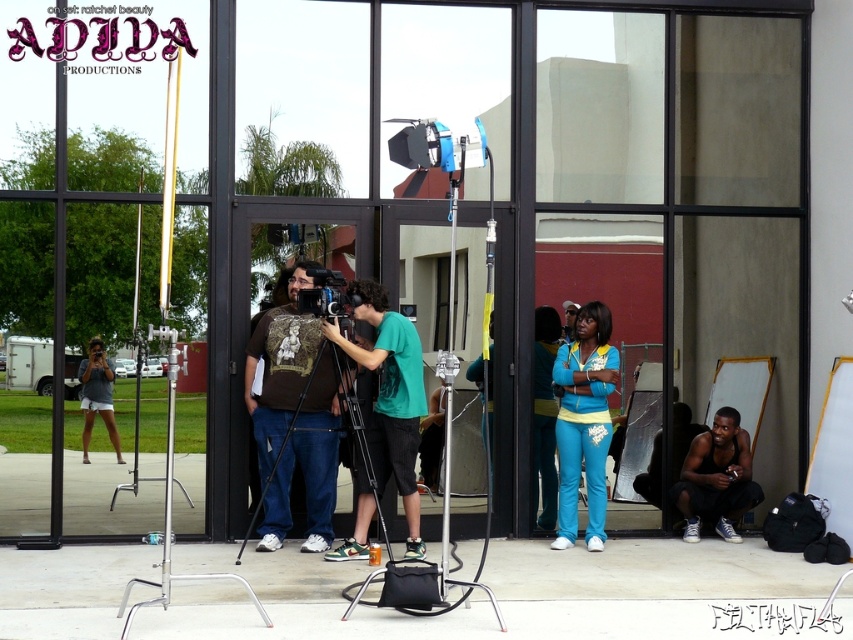
In the scene shown: You are a costume designer who needs to determine if the matte blue jumpsuit at center can be worn over the matte black video camera at center. Based on their sizes, is this feasible?

The matte blue jumpsuit at center is thinner than the matte black video camera at center, so it is not feasible to wear the matte blue jumpsuit at center over the matte black video camera at center as the jumpsuit is narrower in width.

You are an actor standing behind the camera crew and want to see both the green matte shirt at center and the matte black video camera at center. Which object is closer to you?

The green matte shirt at center is closer to you because it is positioned under the matte black video camera at center, meaning it is in a lower and nearer position relative to your viewpoint.